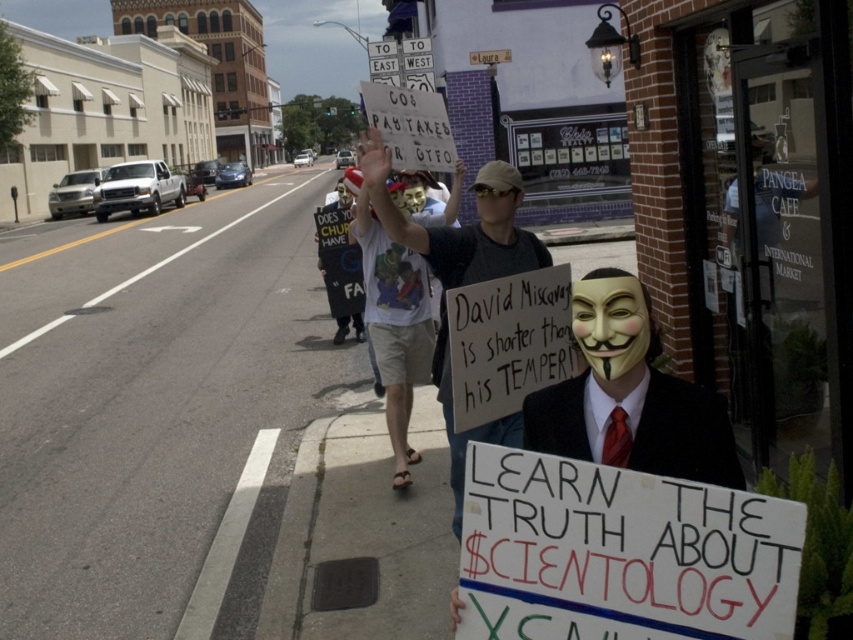
Is the position of white cardboard sign at lower center more distant than that of white t-shirt at center?

No, white cardboard sign at lower center is closer to the viewer.

From the picture: Who is taller, white cardboard sign at lower center or white t-shirt at center?

white t-shirt at center is taller.

You are a GUI agent. You are given a task and a screenshot of the screen. Output one action in this format:
    pyautogui.click(x=<x>, y=<y>)
    Task: Click on the white cardboard sign at lower center
    This screenshot has width=853, height=640.
    Given the screenshot: What is the action you would take?
    pyautogui.click(x=619, y=554)

Identify the location of white cardboard sign at lower center. (619, 554).